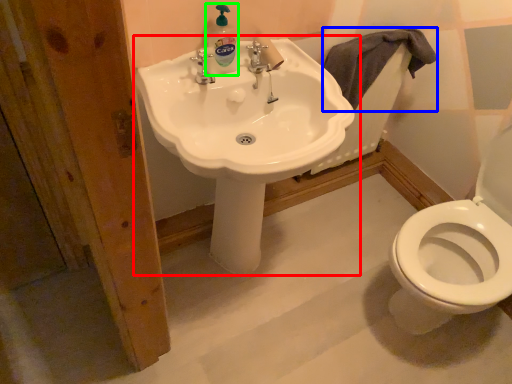
Question: Which object is the farthest from sink (highlighted by a red box)? Choose among these: bath towel (highlighted by a blue box) or cleaning product (highlighted by a green box).

Choices:
 (A) bath towel
 (B) cleaning product

Answer: (A)